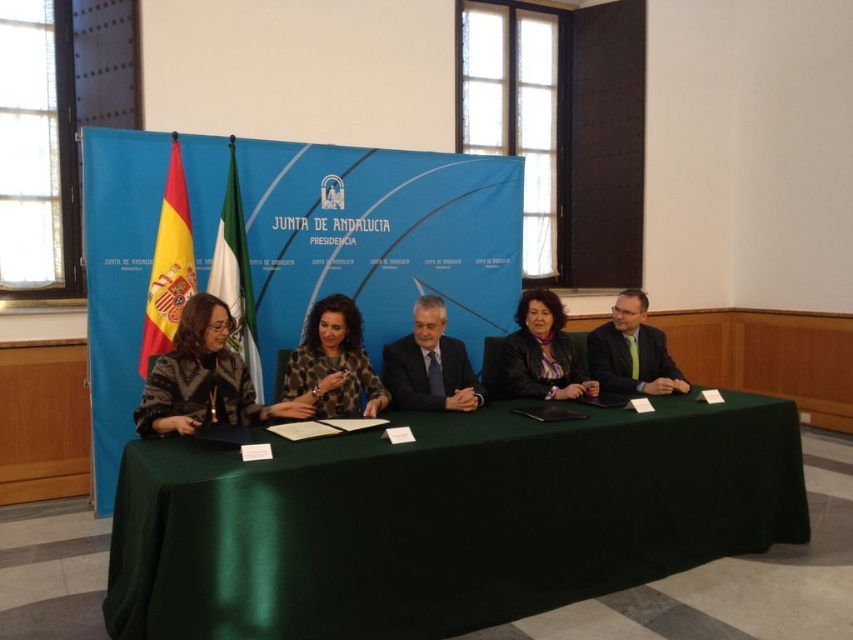
Question: Can you confirm if leopard print jacket at center is bigger than green fabric flag at left?

Choices:
 (A) no
 (B) yes

Answer: (B)

Question: Is green satin table at center closer to the viewer compared to red fabric flag at left?

Choices:
 (A) yes
 (B) no

Answer: (A)

Question: Can you confirm if green satin table at center is positioned to the left of leopard print jacket at center?

Choices:
 (A) no
 (B) yes

Answer: (A)

Question: Estimate the real-world distances between objects in this image. Which object is closer to the matte black suit at center?

Choices:
 (A) green satin table at center
 (B) patterned fabric jacket at left

Answer: (A)

Question: Which object is farther from the camera taking this photo?

Choices:
 (A) leather jacket at center
 (B) red fabric flag at left

Answer: (B)

Question: Which object is farther from the camera taking this photo?

Choices:
 (A) matte black suit at center
 (B) leather jacket at center

Answer: (A)